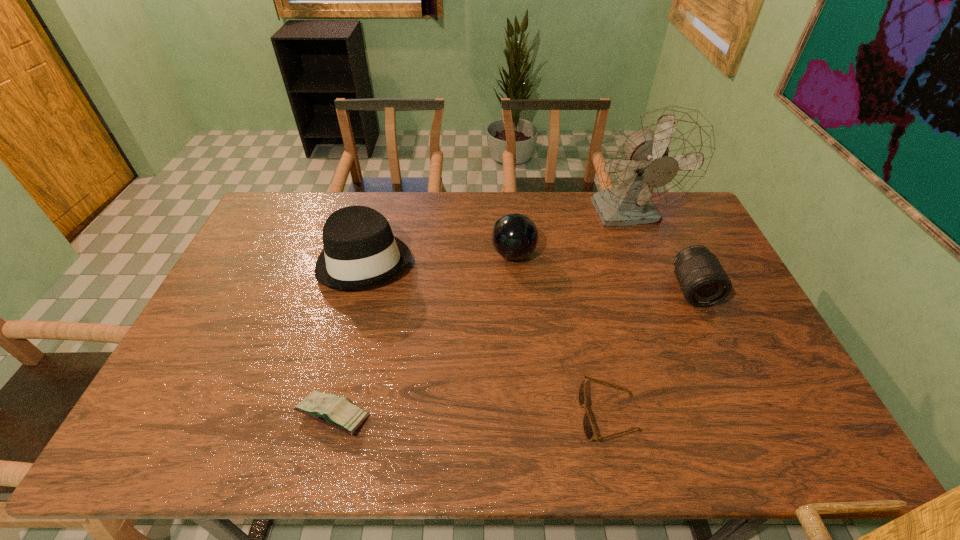
At what (x,y) coordinates should I click in order to perform the action: click on the tallest object. Please return your answer as a coordinate pair (x, y). The height and width of the screenshot is (540, 960). Looking at the image, I should click on (658, 158).

The width and height of the screenshot is (960, 540). Find the location of `the fifth shortest object`. the fifth shortest object is located at coordinates (360, 250).

Locate an element on the screen. The image size is (960, 540). the third object from left to right is located at coordinates (514, 236).

Where is `bowling ball`? This screenshot has width=960, height=540. bowling ball is located at coordinates (514, 236).

Locate an element on the screen. Image resolution: width=960 pixels, height=540 pixels. telephoto lens is located at coordinates (703, 281).

Find the location of a particular element. This screenshot has height=540, width=960. sunglasses is located at coordinates (588, 428).

Where is `diary`? diary is located at coordinates (338, 412).

This screenshot has width=960, height=540. In order to click on vacant space situated 0.210m in front of the tallest object to blow air in this screenshot , I will do `click(656, 284)`.

You are a GUI agent. You are given a task and a screenshot of the screen. Output one action in this format:
    pyautogui.click(x=<x>, y=<y>)
    Task: Click on the vacant space located on the back of the fedora
    This screenshot has height=540, width=960.
    Given the screenshot: What is the action you would take?
    pyautogui.click(x=378, y=211)

At what (x,y) coordinates should I click in order to perform the action: click on vacant region located on the side of the bowling ball with the finger holes. Please return your answer as a coordinate pair (x, y). Looking at the image, I should click on (469, 254).